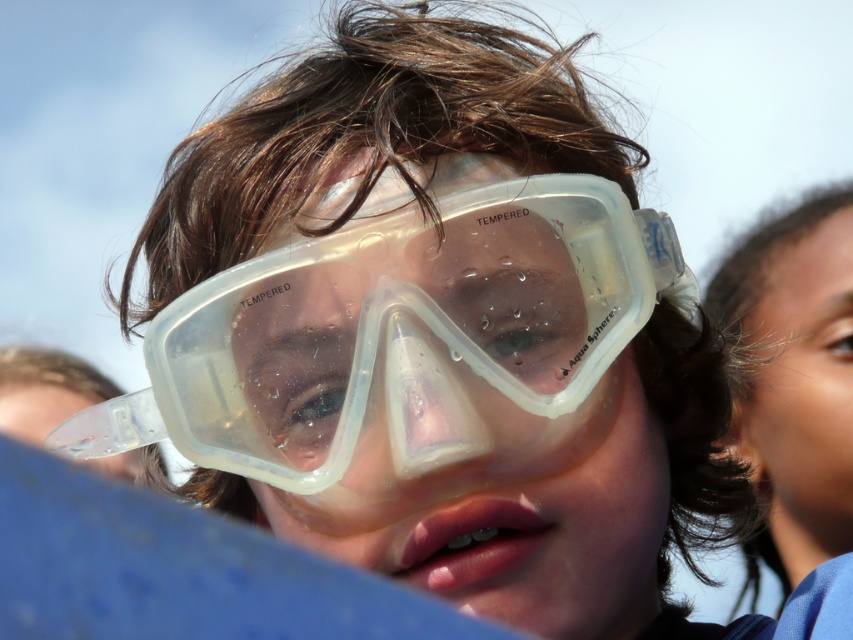
You are a photographer adjusting the focus on your camera. You notice the transparent plastic goggles at center and the smooth skin face at upper right in your viewfinder. Which object appears narrower in the frame?

The transparent plastic goggles at center appears narrower than the smooth skin face at upper right because it has a lesser width compared to it.

You are a photographer adjusting the focus on your camera. You notice the transparent plastic goggles at center and the smooth skin face at upper right. Which object should you focus on first if you want to ensure both are in focus?

The transparent plastic goggles at center is in front of the smooth skin face at upper right, so you should focus on the transparent plastic goggles at center first to ensure both are in focus.